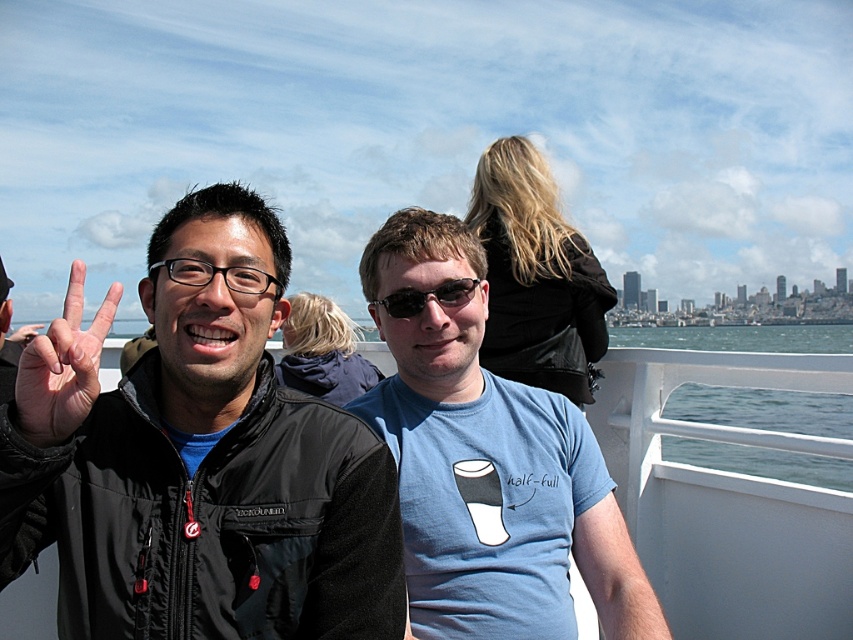
Question: Which of the following is the closest to the observer?

Choices:
 (A) (750, 346)
 (B) (280, 493)
 (C) (383, 300)

Answer: (B)

Question: Is black matte jacket at left positioned in front of black plastic glasses at upper center?

Choices:
 (A) yes
 (B) no

Answer: (A)

Question: Which point is closer to the camera?

Choices:
 (A) black plastic glasses at upper center
 (B) white plastic boat at center
 (C) sunglasses at center
 (D) blue cotton t-shirt at center

Answer: (A)

Question: Is black matte jacket at left further to the viewer compared to blue cotton t-shirt at center?

Choices:
 (A) no
 (B) yes

Answer: (A)

Question: Can you confirm if blue cotton t-shirt at center is thinner than black plastic glasses at upper center?

Choices:
 (A) yes
 (B) no

Answer: (A)

Question: Which object appears farthest from the camera in this image?

Choices:
 (A) white plastic boat at center
 (B) black matte jacket at left
 (C) skinny-fingered hand at left

Answer: (A)